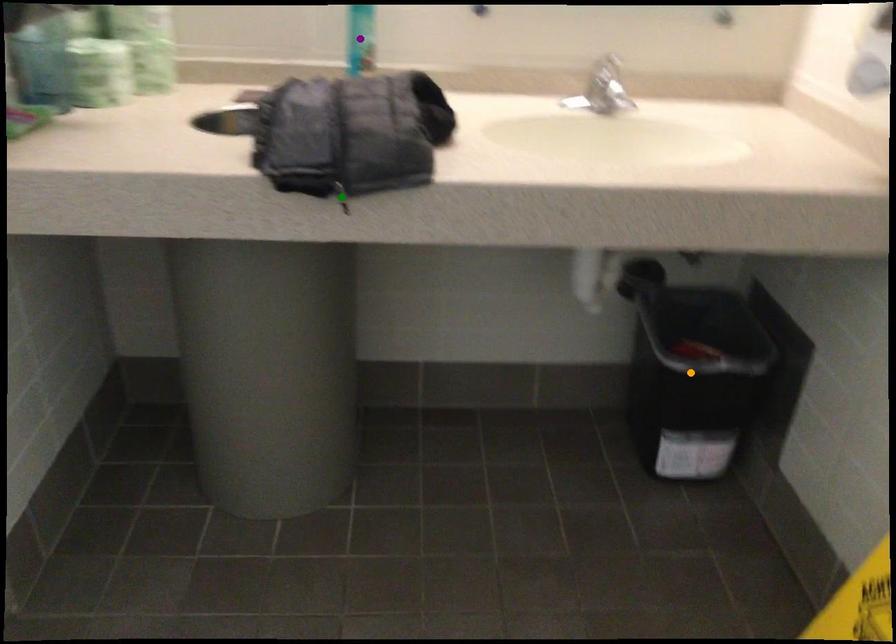
Looking at this image, order these from nearest to farthest:
- green point
- purple point
- orange point

orange point < purple point < green point